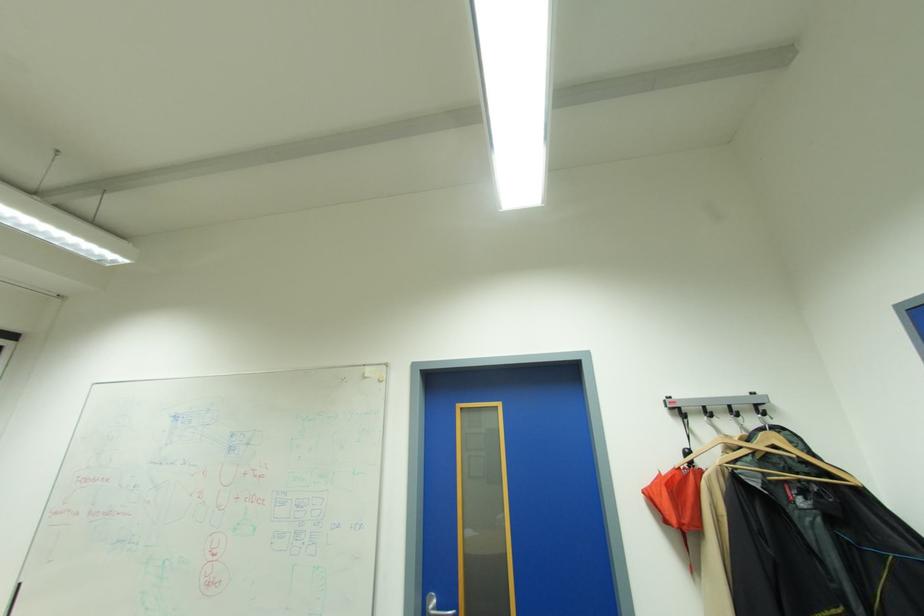
Image resolution: width=924 pixels, height=616 pixels. Describe the element at coordinates (439, 612) in the screenshot. I see `the silver door handle` at that location.